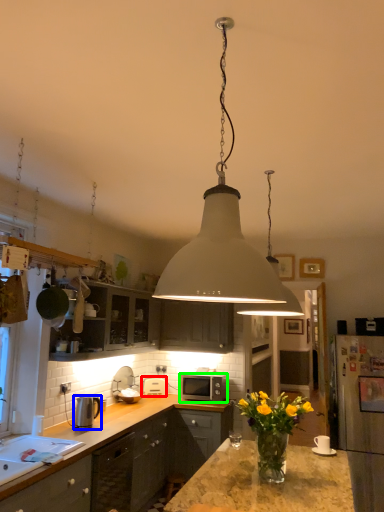
Question: Based on their relative distances, which object is farther from appliance (highlighted by a red box)? Choose from appliance (highlighted by a blue box) and microwave oven (highlighted by a green box).

Choices:
 (A) appliance
 (B) microwave oven

Answer: (A)